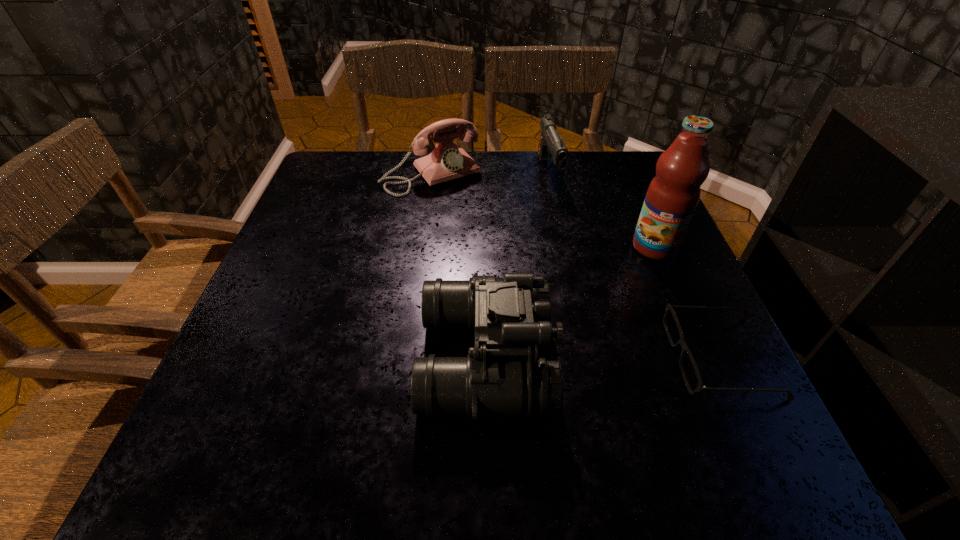
The width and height of the screenshot is (960, 540). What are the coordinates of `free spot on the desktop that is between the binoculars and the shortest object and is positioned on the dial of the telephone` in the screenshot? It's located at click(x=580, y=357).

Locate an element on the screen. free space on the desktop that is between the binoculars and the shortest object and is positioned on the front label of the fruit juice is located at coordinates (599, 357).

At what (x,y) coordinates should I click in order to perform the action: click on vacant space on the desktop that is between the binoculars and the spectacles and is positioned in the direction the third object from left to right is aimed. Please return your answer as a coordinate pair (x, y). This screenshot has height=540, width=960. Looking at the image, I should click on (625, 357).